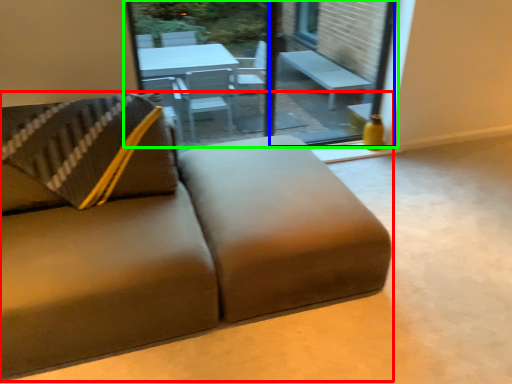
Question: Which is farther away from studio couch (highlighted by a red box)? window screen (highlighted by a blue box) or window (highlighted by a green box)?

Choices:
 (A) window screen
 (B) window

Answer: (A)